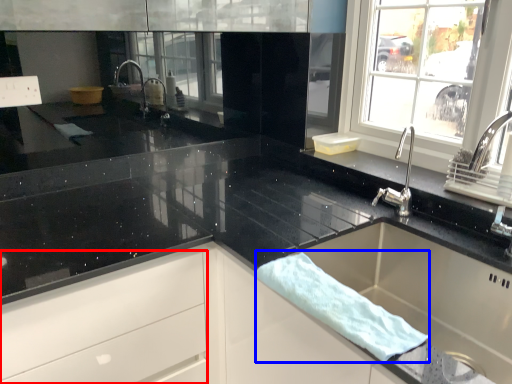
Question: Which of the following is the closest to the observer, drawer (highlighted by a red box) or bath towel (highlighted by a blue box)?

Choices:
 (A) drawer
 (B) bath towel

Answer: (B)